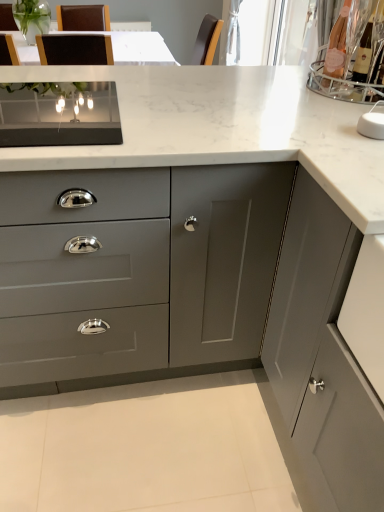
Describe the element at coordinates (136, 273) in the screenshot. I see `matte gray cabinet at center, which is the second cabinetry from front to back` at that location.

The image size is (384, 512). What are the coordinates of `matte gray cabinet at center, the first cabinetry positioned from the back` in the screenshot? It's located at (136, 273).

What do you see at coordinates (322, 357) in the screenshot? The height and width of the screenshot is (512, 384). I see `matte gray cabinet at right, placed as the 2th cabinetry when sorted from left to right` at bounding box center [322, 357].

I want to click on matte gray cabinet at right, which is counted as the 2th cabinetry, starting from the back, so click(322, 357).

Where is `matte gray cabinet at center, which ranks as the first cabinetry in left-to-right order`? matte gray cabinet at center, which ranks as the first cabinetry in left-to-right order is located at coordinates (136, 273).

Considering the relative positions of matte gray cabinet at center, the first cabinetry positioned from the back, and matte gray cabinet at right, the first cabinetry in the right-to-left sequence, in the image provided, is matte gray cabinet at center, the first cabinetry positioned from the back, to the left or to the right of matte gray cabinet at right, the first cabinetry in the right-to-left sequence,?

Based on their positions, matte gray cabinet at center, the first cabinetry positioned from the back, is located to the left of matte gray cabinet at right, the first cabinetry in the right-to-left sequence.

Considering their positions, is matte gray cabinet at center, the first cabinetry positioned from the back, located in front of or behind matte gray cabinet at right, the first cabinetry from the front?

In the image, matte gray cabinet at center, the first cabinetry positioned from the back, appears behind matte gray cabinet at right, the first cabinetry from the front.

Considering the points (111, 254) and (340, 367), which point is in front, point (111, 254) or point (340, 367)?

The point (340, 367) is more forward.

Consider the image. From the image's perspective, is matte gray cabinet at center, arranged as the second cabinetry when viewed from the right, beneath matte gray cabinet at right, which is counted as the 2th cabinetry, starting from the back?

Incorrect, from the image's perspective, matte gray cabinet at center, arranged as the second cabinetry when viewed from the right, is higher than matte gray cabinet at right, which is counted as the 2th cabinetry, starting from the back.

From a real-world perspective, which object stands above the other?

matte gray cabinet at right, which is counted as the 2th cabinetry, starting from the back.

Is matte gray cabinet at center, arranged as the second cabinetry when viewed from the right, wider or thinner than matte gray cabinet at right, placed as the 2th cabinetry when sorted from left to right?

Clearly, matte gray cabinet at center, arranged as the second cabinetry when viewed from the right, has more width compared to matte gray cabinet at right, placed as the 2th cabinetry when sorted from left to right.

Is matte gray cabinet at center, which ranks as the first cabinetry in left-to-right order, taller than matte gray cabinet at right, the first cabinetry from the front?

In fact, matte gray cabinet at center, which ranks as the first cabinetry in left-to-right order, may be shorter than matte gray cabinet at right, the first cabinetry from the front.

In terms of size, does matte gray cabinet at center, which ranks as the first cabinetry in left-to-right order, appear bigger or smaller than matte gray cabinet at right, placed as the 2th cabinetry when sorted from left to right?

Clearly, matte gray cabinet at center, which ranks as the first cabinetry in left-to-right order, is smaller in size than matte gray cabinet at right, placed as the 2th cabinetry when sorted from left to right.

Is matte gray cabinet at center, the first cabinetry positioned from the back, outside of matte gray cabinet at right, the first cabinetry from the front?

Yes, matte gray cabinet at center, the first cabinetry positioned from the back, is outside of matte gray cabinet at right, the first cabinetry from the front.

Is matte gray cabinet at center, which is the second cabinetry from front to back, positioned far away from matte gray cabinet at right, the first cabinetry in the right-to-left sequence?

No, there isn't a large distance between matte gray cabinet at center, which is the second cabinetry from front to back, and matte gray cabinet at right, the first cabinetry in the right-to-left sequence.

Is matte gray cabinet at center, the first cabinetry positioned from the back, looking in the opposite direction of matte gray cabinet at right, placed as the 2th cabinetry when sorted from left to right?

No, matte gray cabinet at center, the first cabinetry positioned from the back,'s orientation is not away from matte gray cabinet at right, placed as the 2th cabinetry when sorted from left to right.

How many degrees apart are the facing directions of matte gray cabinet at center, which is the second cabinetry from front to back, and matte gray cabinet at right, placed as the 2th cabinetry when sorted from left to right?

89 degrees.

How much distance is there between matte gray cabinet at center, which is the second cabinetry from front to back, and matte gray cabinet at right, the first cabinetry in the right-to-left sequence?

matte gray cabinet at center, which is the second cabinetry from front to back, is 35.39 centimeters away from matte gray cabinet at right, the first cabinetry in the right-to-left sequence.

Locate an element on the screen. Image resolution: width=384 pixels, height=512 pixels. cabinetry in front of the matte gray cabinet at center, which ranks as the first cabinetry in left-to-right order is located at coordinates (322, 357).

Which object is positioned more to the right, matte gray cabinet at right, the first cabinetry from the front, or matte gray cabinet at center, which is the second cabinetry from front to back?

matte gray cabinet at right, the first cabinetry from the front, is more to the right.

Which object is closer to the camera taking this photo, matte gray cabinet at right, which is counted as the 2th cabinetry, starting from the back, or matte gray cabinet at center, which is the second cabinetry from front to back?

matte gray cabinet at right, which is counted as the 2th cabinetry, starting from the back, is in front.

Which point is more distant from viewer, (329,482) or (90,328)?

The point (90,328) is farther from the camera.

From the image's perspective, is matte gray cabinet at right, the first cabinetry in the right-to-left sequence, above or below matte gray cabinet at center, which ranks as the first cabinetry in left-to-right order?

matte gray cabinet at right, the first cabinetry in the right-to-left sequence, is below matte gray cabinet at center, which ranks as the first cabinetry in left-to-right order.

From a real-world perspective, is matte gray cabinet at right, placed as the 2th cabinetry when sorted from left to right, above or below matte gray cabinet at center, arranged as the second cabinetry when viewed from the right?

matte gray cabinet at right, placed as the 2th cabinetry when sorted from left to right, is above matte gray cabinet at center, arranged as the second cabinetry when viewed from the right.

Which of these two, matte gray cabinet at right, the first cabinetry from the front, or matte gray cabinet at center, the first cabinetry positioned from the back, is wider?

With larger width is matte gray cabinet at center, the first cabinetry positioned from the back.

Who is shorter, matte gray cabinet at right, which is counted as the 2th cabinetry, starting from the back, or matte gray cabinet at center, which is the second cabinetry from front to back?

Standing shorter between the two is matte gray cabinet at center, which is the second cabinetry from front to back.

Who is bigger, matte gray cabinet at right, placed as the 2th cabinetry when sorted from left to right, or matte gray cabinet at center, the first cabinetry positioned from the back?

With larger size is matte gray cabinet at right, placed as the 2th cabinetry when sorted from left to right.

Which is correct: matte gray cabinet at right, placed as the 2th cabinetry when sorted from left to right, is inside matte gray cabinet at center, the first cabinetry positioned from the back, or outside of it?

matte gray cabinet at right, placed as the 2th cabinetry when sorted from left to right, is spatially situated outside matte gray cabinet at center, the first cabinetry positioned from the back.

Are matte gray cabinet at right, placed as the 2th cabinetry when sorted from left to right, and matte gray cabinet at center, the first cabinetry positioned from the back, far apart?

Actually, matte gray cabinet at right, placed as the 2th cabinetry when sorted from left to right, and matte gray cabinet at center, the first cabinetry positioned from the back, are a little close together.

Could you tell me if matte gray cabinet at right, placed as the 2th cabinetry when sorted from left to right, is turned towards matte gray cabinet at center, which ranks as the first cabinetry in left-to-right order?

No.

From the picture: How many degrees apart are the facing directions of matte gray cabinet at right, the first cabinetry in the right-to-left sequence, and matte gray cabinet at center, arranged as the second cabinetry when viewed from the right?

89 degrees separate the facing orientations of matte gray cabinet at right, the first cabinetry in the right-to-left sequence, and matte gray cabinet at center, arranged as the second cabinetry when viewed from the right.

The height and width of the screenshot is (512, 384). Find the location of `cabinetry above the matte gray cabinet at right, which is counted as the 2th cabinetry, starting from the back (from the image's perspective)`. cabinetry above the matte gray cabinet at right, which is counted as the 2th cabinetry, starting from the back (from the image's perspective) is located at coordinates (136, 273).

Where is `cabinetry behind the matte gray cabinet at right, the first cabinetry from the front`? cabinetry behind the matte gray cabinet at right, the first cabinetry from the front is located at coordinates [136, 273].

You are a GUI agent. You are given a task and a screenshot of the screen. Output one action in this format:
    pyautogui.click(x=<x>, y=<y>)
    Task: Click on the cabinetry on the right of matte gray cabinet at center, which is the second cabinetry from front to back
    Image resolution: width=384 pixels, height=512 pixels.
    Given the screenshot: What is the action you would take?
    pyautogui.click(x=322, y=357)